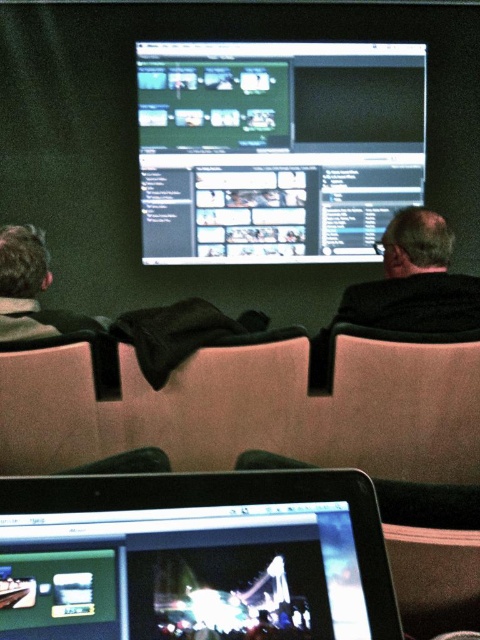
You are standing in the conference room and need to reach the matte black monitor at center. According to the coordinates provided, where should you move to in order to reach it?

You should move to point (x=276, y=148) to reach the matte black monitor at center.

You are a video editor working in this conference room. You need to access both the matte black monitor at center and the gray woolen sweater at left. Which object is located above the other?

The matte black monitor at center is positioned over the gray woolen sweater at left, so the matte black monitor at center is above the gray woolen sweater at left.

Looking at this image, you are setting up a presentation and need to decide which device to use for displaying the video editing project. Considering the size of the shiny silver laptop at lower center and the matte black monitor at center, which device would provide a larger screen for the audience to view?

The matte black monitor at center is larger in size compared to the shiny silver laptop at lower center, so it would provide a larger screen for the audience to view.